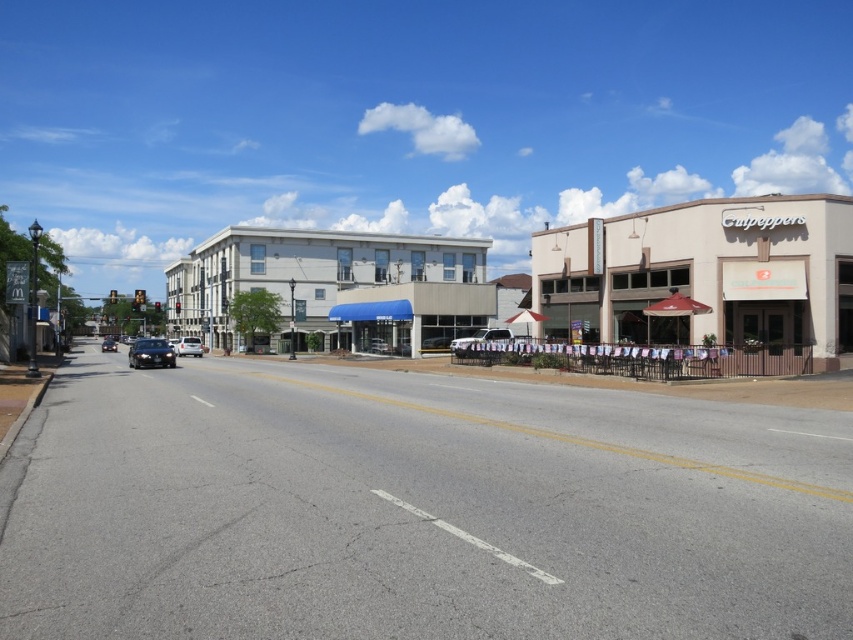
Does beige/textured building at right appear under satin silver suv at center?

No.

Is point (814, 227) farther from camera compared to point (486, 330)?

No, it is in front of (486, 330).

You are a GUI agent. You are given a task and a screenshot of the screen. Output one action in this format:
    pyautogui.click(x=<x>, y=<y>)
    Task: Click on the beige/textured building at right
    This screenshot has height=640, width=853.
    Given the screenshot: What is the action you would take?
    pyautogui.click(x=704, y=275)

At what (x,y) coordinates should I click in order to perform the action: click on beige/textured building at right. Please return your answer as a coordinate pair (x, y). Looking at the image, I should click on (704, 275).

Between beige/textured building at right and shiny black sedan at left, which one appears on the left side from the viewer's perspective?

shiny black sedan at left

Locate an element on the screen. beige/textured building at right is located at coordinates (704, 275).

Is point (469, 349) more distant than point (177, 352)?

That is False.

Between point (479, 330) and point (186, 340), which one is positioned in front?

Positioned in front is point (479, 330).

The width and height of the screenshot is (853, 640). I want to click on satin silver suv at center, so click(479, 339).

The image size is (853, 640). Find the location of `satin silver suv at center`. satin silver suv at center is located at coordinates pos(479,339).